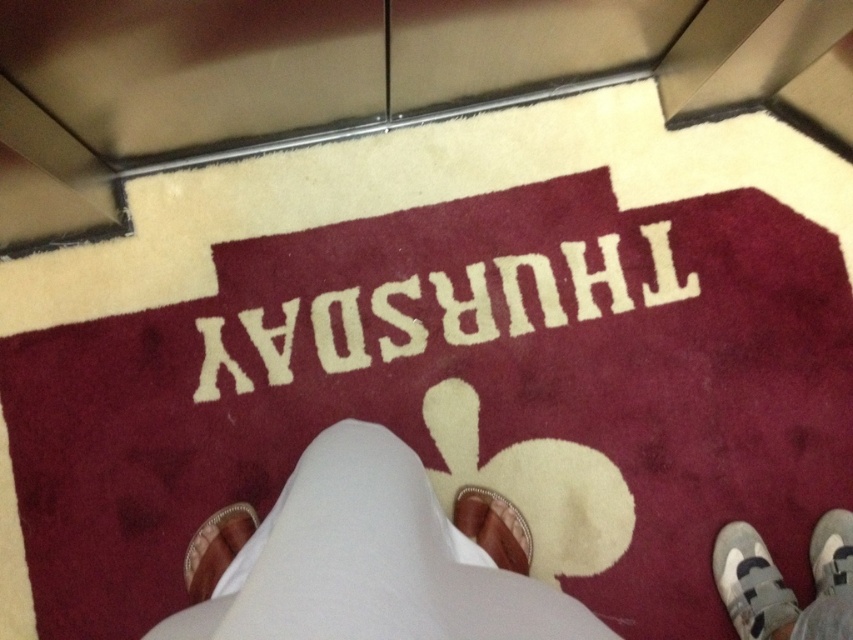
You are organizing a craft fair and need to arrange items on a shelf. You have a white yarn thursday at center and a leather at lower left. Based on their sizes, which item should you place first to ensure stability?

The white yarn thursday at center is larger in size than the leather at lower left, so you should place the white yarn thursday at center first to ensure stability as larger items provide a stable base.

You are a fashion designer observing a person wearing white leather pants at center and white fabric shoe at lower right. Which item is closer to you?

The white leather pants at center is closer to you since it is in front of the white fabric shoe at lower right.

You are a delivery robot trying to navigate around the leather at lower left and the white fabric shoe at lower right. Which object should you avoid first to move forward?

The leather at lower left is closer to the viewer than the white fabric shoe at lower right, so you should avoid the leather at lower left first to move forward.